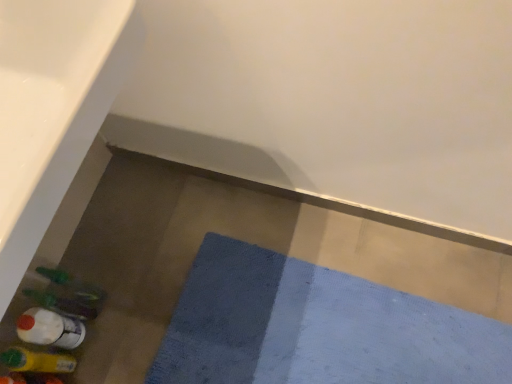
Identify the location of vacant area that lies to the right of translucent plastic bottle at lower left, which is the second bottle from top to bottom. [x=127, y=319].